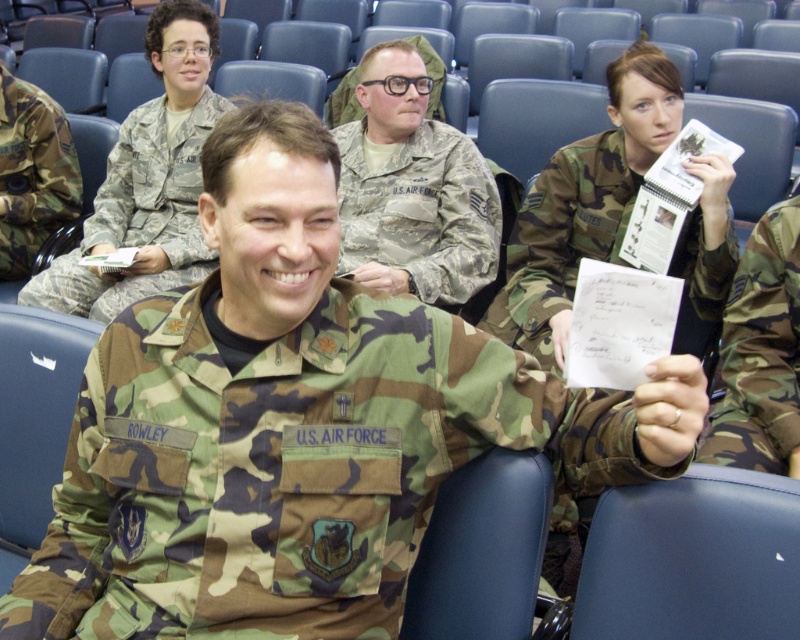
Is camouflage fabric notebook at upper right above camouflage fabric uniform at left?

No, camouflage fabric notebook at upper right is not above camouflage fabric uniform at left.

Does point (640, 176) come farther from viewer compared to point (4, 202)?

No.

Find the location of `camouflage fabric notebook at upper right`. camouflage fabric notebook at upper right is located at coordinates (562, 237).

Is camouflage fabric uniform at center to the left of camouflage fabric uniform at left from the viewer's perspective?

In fact, camouflage fabric uniform at center is to the right of camouflage fabric uniform at left.

Does camouflage fabric uniform at center have a larger size compared to camouflage fabric uniform at left?

Correct, camouflage fabric uniform at center is larger in size than camouflage fabric uniform at left.

What do you see at coordinates (140, 214) in the screenshot? Image resolution: width=800 pixels, height=640 pixels. I see `camouflage fabric uniform at center` at bounding box center [140, 214].

Image resolution: width=800 pixels, height=640 pixels. What are the coordinates of `camouflage fabric uniform at center` in the screenshot? It's located at (140, 214).

Who is taller, camouflage fabric uniform at center or camo fabric pants at lower right?

With more height is camouflage fabric uniform at center.

Does point (92, 280) come in front of point (750, 282)?

No.

Does point (81, 292) come in front of point (770, 333)?

No.

I want to click on camouflage fabric uniform at center, so click(140, 214).